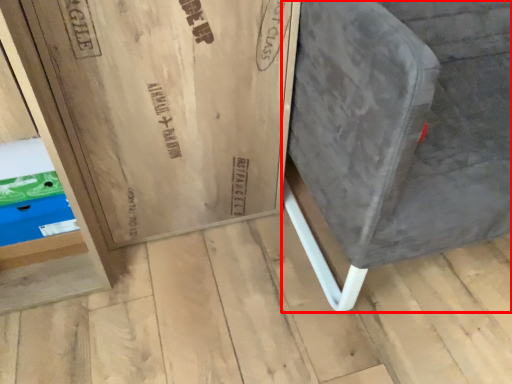
Question: From the image's perspective, considering the relative positions of furniture (annotated by the red box) and shelf in the image provided, where is furniture (annotated by the red box) located with respect to the staircase?

Choices:
 (A) below
 (B) above

Answer: (B)